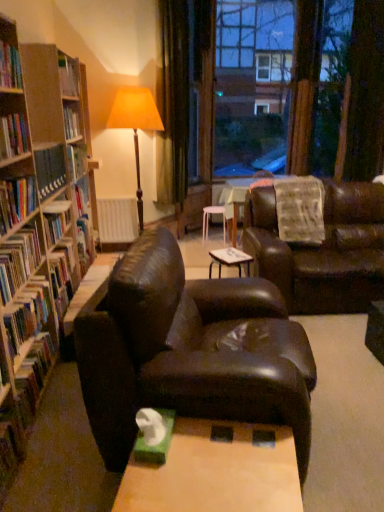
Image resolution: width=384 pixels, height=512 pixels. What are the coordinates of `free point above white matte radiator at center (from a real-world perspective)` in the screenshot? It's located at (114, 195).